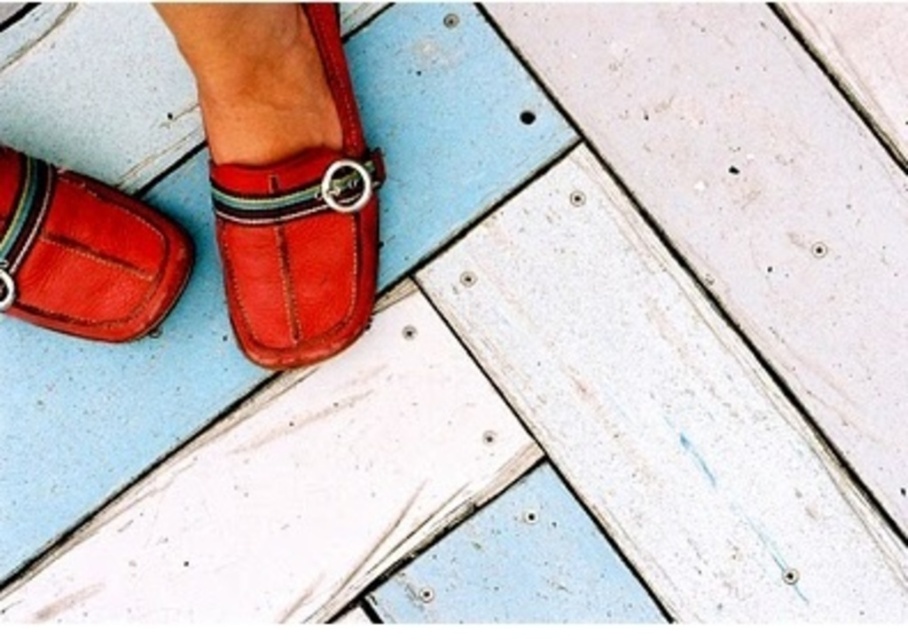
Looking at this image, which is above, leather loafer at center or matte leather shoe at lower left?

leather loafer at center is higher up.

Does leather loafer at center appear under matte leather shoe at lower left?

Actually, leather loafer at center is above matte leather shoe at lower left.

Is point (245, 134) in front of point (123, 292)?

That is True.

The image size is (908, 640). Identify the location of leather loafer at center. (284, 173).